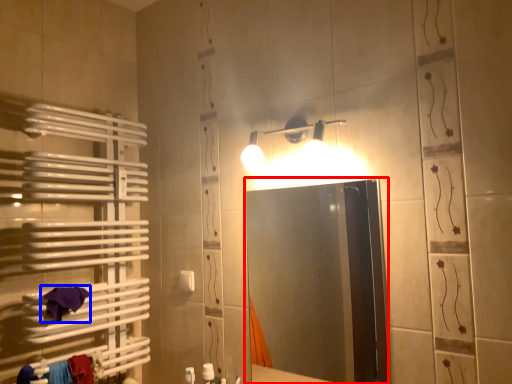
Question: Which of the following is the farthest to the observer, mirror (highlighted by a red box) or bath towel (highlighted by a blue box)?

Choices:
 (A) mirror
 (B) bath towel

Answer: (B)